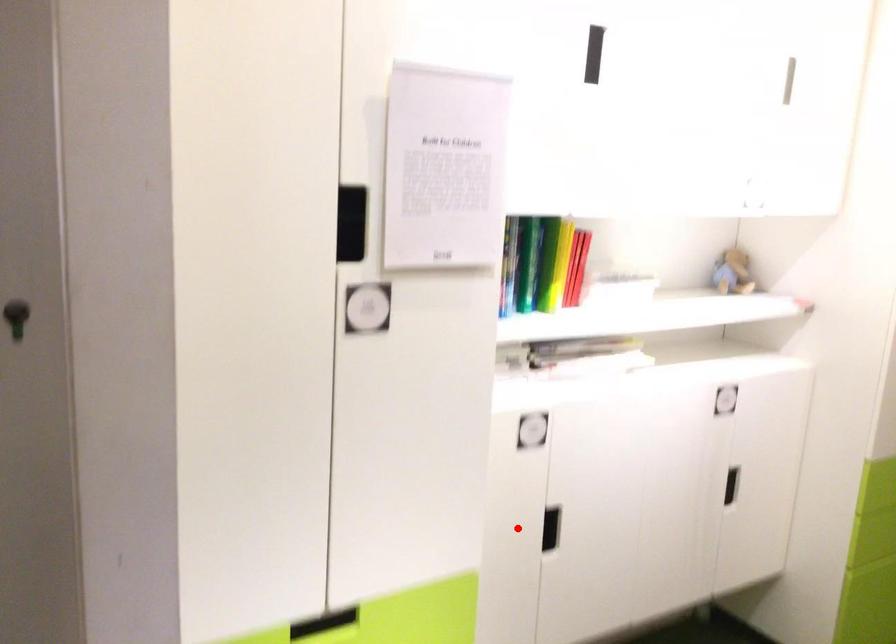
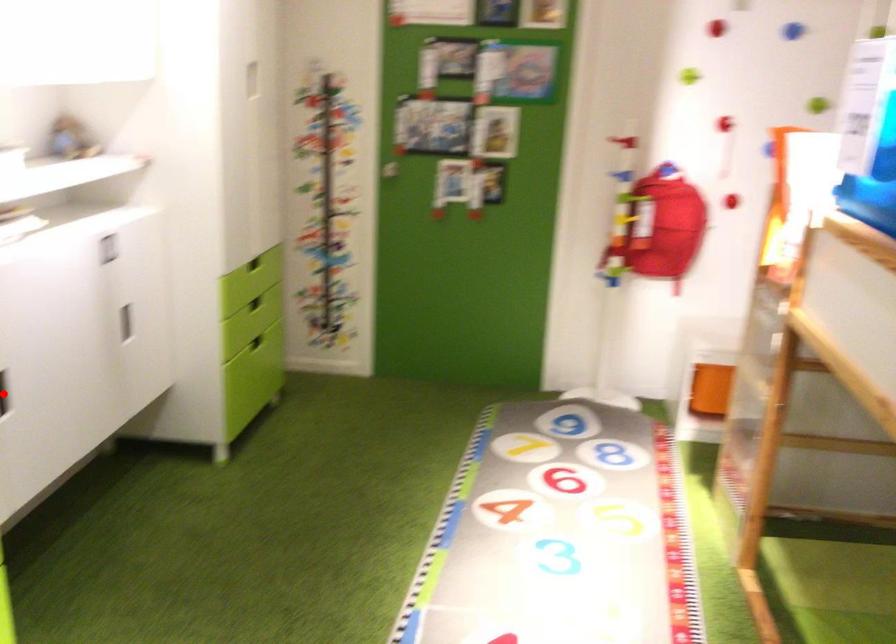
I am providing you with two images of the same scene from different viewpoints. A red point is marked on the first image and another point is marked on the second image. Is the marked point in image1 the same physical position as the marked point in image2?

Yes